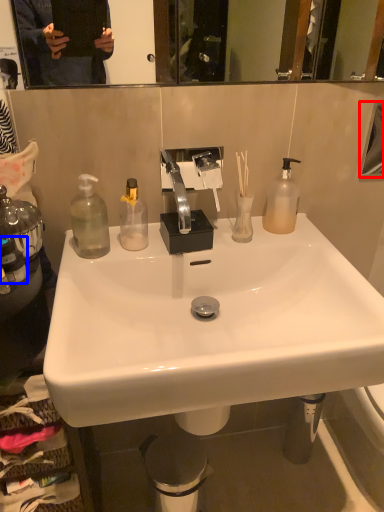
Question: Which point is closer to the camera, mirror (highlighted by a red box) or bottle (highlighted by a blue box)?

Choices:
 (A) mirror
 (B) bottle

Answer: (B)